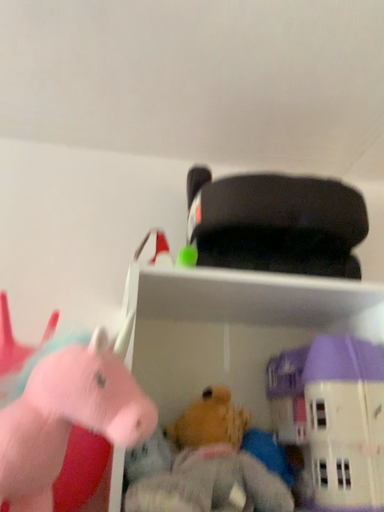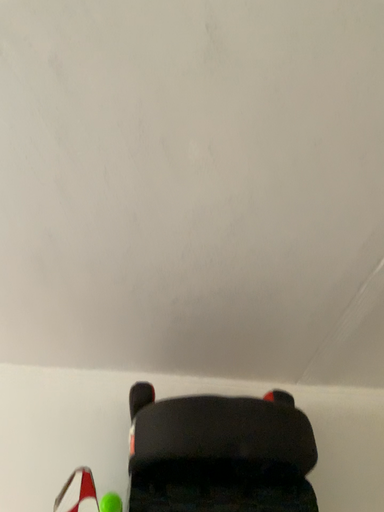
Question: Which way did the camera rotate in the video?

Choices:
 (A) rotated upward
 (B) rotated downward

Answer: (A)